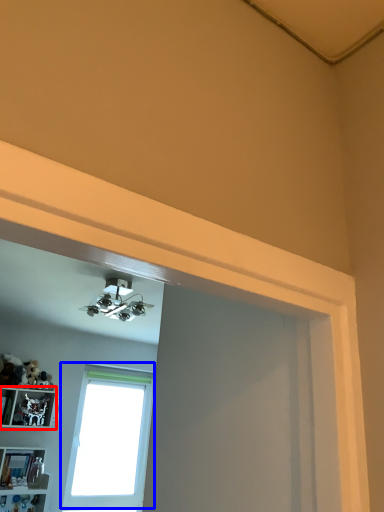
Question: Among these objects, which one is farthest to the camera, shelf (highlighted by a red box) or window (highlighted by a blue box)?

Choices:
 (A) shelf
 (B) window

Answer: (B)